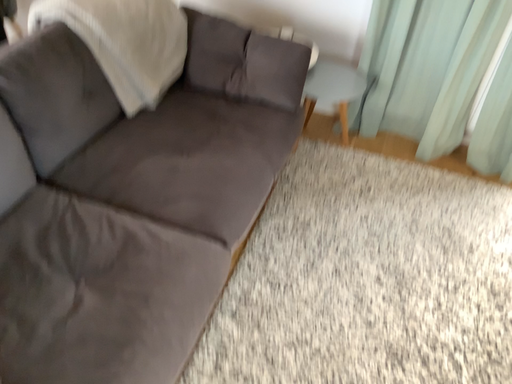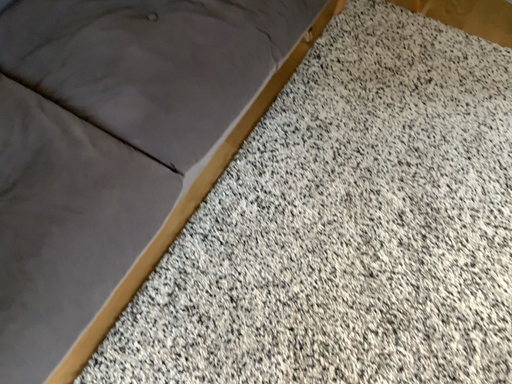
Question: Which way did the camera rotate in the video?

Choices:
 (A) rotated upward
 (B) rotated downward

Answer: (B)